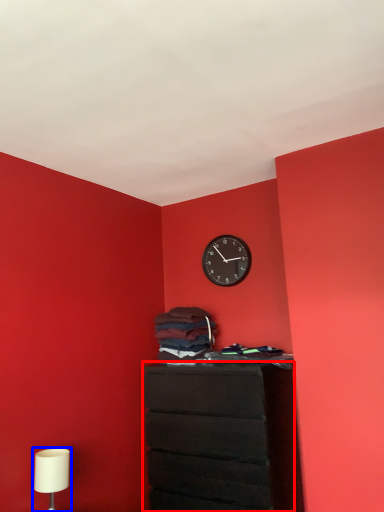
Question: Which point is closer to the camera, chest of drawers (highlighted by a red box) or table lamp (highlighted by a blue box)?

Choices:
 (A) chest of drawers
 (B) table lamp

Answer: (B)